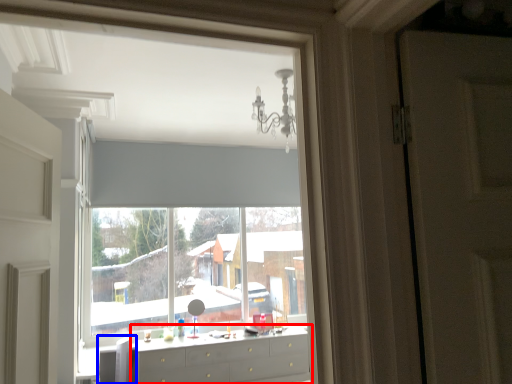
Question: Among these objects, which one is farthest to the camera, chest of drawers (highlighted by a red box) or swivel chair (highlighted by a blue box)?

Choices:
 (A) chest of drawers
 (B) swivel chair

Answer: (B)